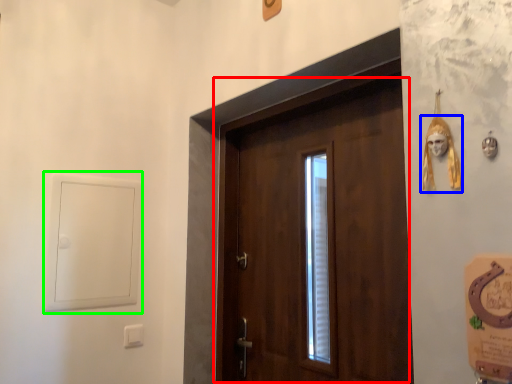
Question: Estimate the real-world distances between objects in this image. Which object is farther from door (highlighted by a red box), skull (highlighted by a blue box) or window (highlighted by a green box)?

Choices:
 (A) skull
 (B) window

Answer: (A)